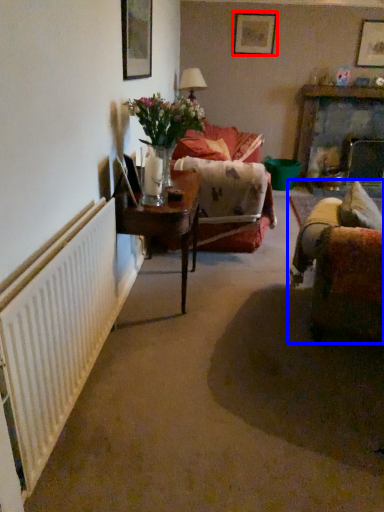
Question: Which of the following is the farthest to the observer, picture frame (highlighted by a red box) or studio couch (highlighted by a blue box)?

Choices:
 (A) picture frame
 (B) studio couch

Answer: (A)